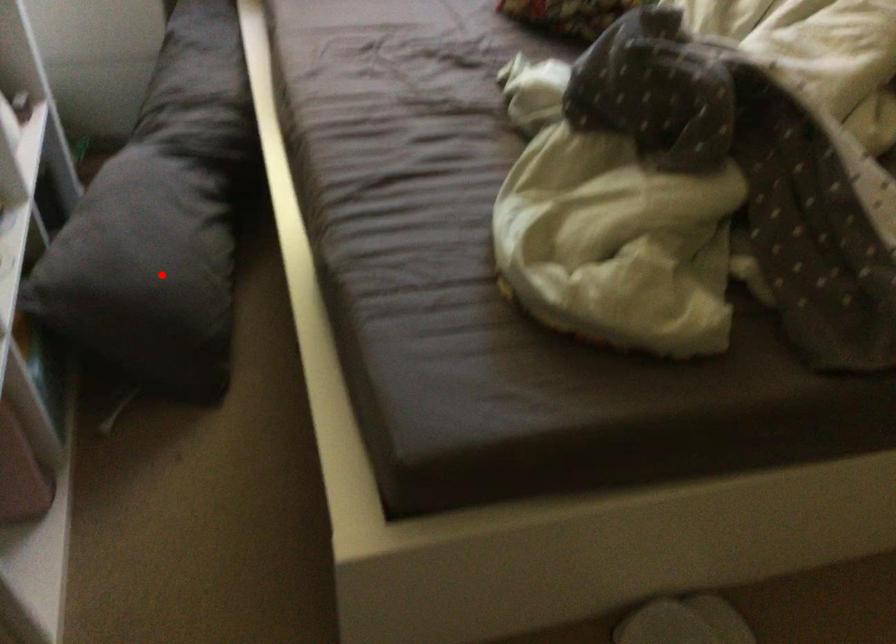
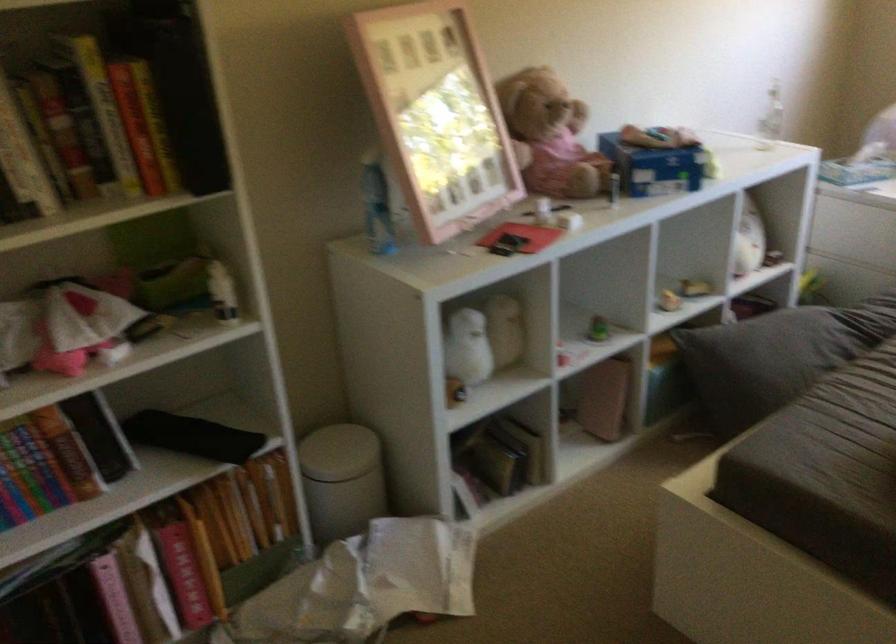
In the second image, find the point that corresponds to the highlighted location in the first image.

(776, 357)